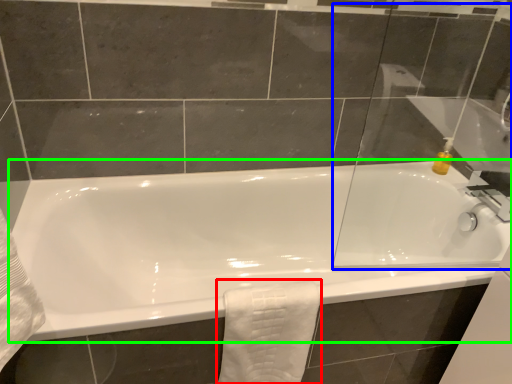
Question: Which is farther away from bath towel (highlighted by a red box)? glass door (highlighted by a blue box) or bathtub (highlighted by a green box)?

Choices:
 (A) glass door
 (B) bathtub

Answer: (A)